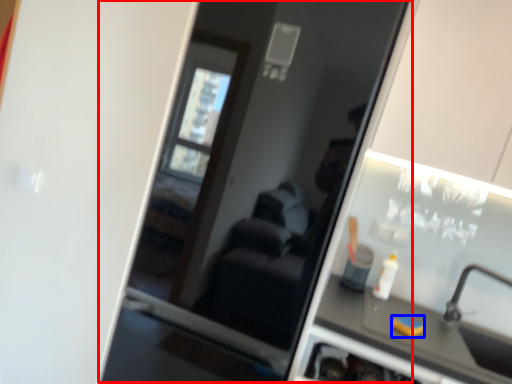
Question: Which point is further to the camera, screen door (highlighted by a red box) or soap (highlighted by a blue box)?

Choices:
 (A) screen door
 (B) soap

Answer: (B)